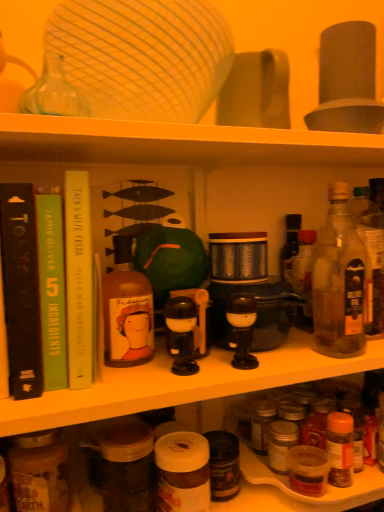
Question: Would you say green paperback book at left, the second book viewed from the left, is outside translucent glass bottle at right, the first bottle viewed from the right?

Choices:
 (A) yes
 (B) no

Answer: (A)

Question: Is green paperback book at left, the second book viewed from the left, aimed at translucent glass bottle at right, the first bottle viewed from the right?

Choices:
 (A) no
 (B) yes

Answer: (A)

Question: From the image's perspective, is green paperback book at left, the second book viewed from the left, above translucent glass bottle at right, the first bottle viewed from the right?

Choices:
 (A) yes
 (B) no

Answer: (A)

Question: Is the depth of green paperback book at left, positioned as the 2th book in right-to-left order, greater than that of translucent glass bottle at right, the first bottle viewed from the right?

Choices:
 (A) yes
 (B) no

Answer: (B)

Question: Does green paperback book at left, the second book viewed from the left, appear on the right side of translucent glass bottle at right, the first bottle viewed from the right?

Choices:
 (A) yes
 (B) no

Answer: (B)

Question: Looking at the image, does brown glass jar at lower left, acting as the 1th bottle starting from the left, seem bigger or smaller compared to black plastic toy at center?

Choices:
 (A) big
 (B) small

Answer: (A)

Question: Relative to black plastic toy at center, is brown glass jar at lower left, acting as the 1th bottle starting from the left, in front or behind?

Choices:
 (A) behind
 (B) front

Answer: (A)

Question: Looking at their shapes, would you say brown glass jar at lower left, positioned as the fourth bottle in right-to-left order, is wider or thinner than black plastic toy at center?

Choices:
 (A) wide
 (B) thin

Answer: (B)

Question: Considering the positions of brown glass jar at lower left, acting as the 1th bottle starting from the left, and black plastic toy at center in the image, is brown glass jar at lower left, acting as the 1th bottle starting from the left, taller or shorter than black plastic toy at center?

Choices:
 (A) short
 (B) tall

Answer: (B)

Question: Is translucent plastic spice jar at lower center bigger or smaller than black matte book at left, which is counted as the third book, starting from the right?

Choices:
 (A) big
 (B) small

Answer: (A)

Question: Is point (337, 494) positioned closer to the camera than point (3, 295)?

Choices:
 (A) farther
 (B) closer

Answer: (A)

Question: In the image, is translucent plastic spice jar at lower center positioned in front of or behind black matte book at left, which is counted as the third book, starting from the right?

Choices:
 (A) front
 (B) behind

Answer: (B)

Question: Considering the relative positions of translucent plastic spice jar at lower center and black matte book at left, the 1th book positioned from the left, in the image provided, is translucent plastic spice jar at lower center to the left or to the right of black matte book at left, the 1th book positioned from the left,?

Choices:
 (A) left
 (B) right

Answer: (B)

Question: In terms of size, does black plastic toy at center appear bigger or smaller than matte black coffee machine at center?

Choices:
 (A) big
 (B) small

Answer: (B)

Question: Looking at their shapes, would you say black plastic toy at center is wider or thinner than matte black coffee machine at center?

Choices:
 (A) thin
 (B) wide

Answer: (A)